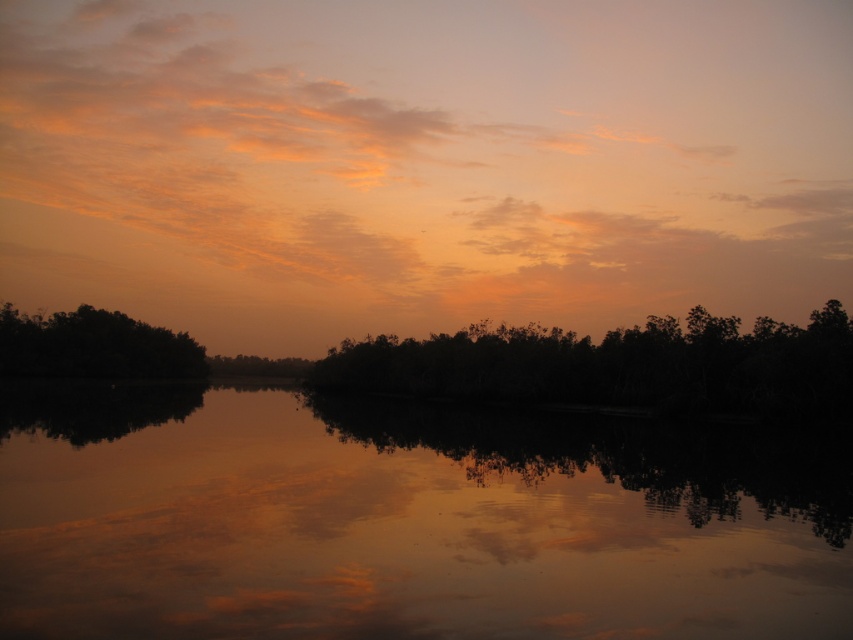
Question: Which point is closer to the camera?

Choices:
 (A) (196, 515)
 (B) (228, 97)
 (C) (103, 310)

Answer: (A)

Question: Does orange matte cloud at upper center have a lesser width compared to silhouette trees at center?

Choices:
 (A) yes
 (B) no

Answer: (B)

Question: Which point appears farthest from the camera in this image?

Choices:
 (A) (100, 326)
 (B) (708, 336)

Answer: (A)

Question: Observing the image, what is the correct spatial positioning of orange matte cloud at upper center in reference to silhouette trees at center?

Choices:
 (A) above
 (B) below

Answer: (A)

Question: Considering the real-world distances, which object is closest to the smooth reflective water at center?

Choices:
 (A) silhouette trees at center
 (B) dark green leafy trees at left
 (C) orange matte cloud at upper center

Answer: (A)

Question: Where is orange matte cloud at upper center located in relation to dark green leafy trees at left in the image?

Choices:
 (A) right
 (B) left

Answer: (A)